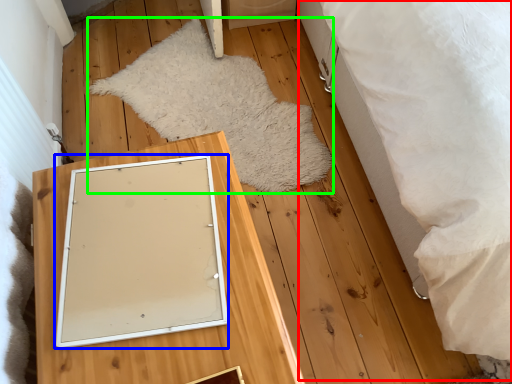
Question: Which is nearer to the bed (highlighted by a red box)? picture frame (highlighted by a blue box) or blanket (highlighted by a green box).

Choices:
 (A) picture frame
 (B) blanket

Answer: (B)